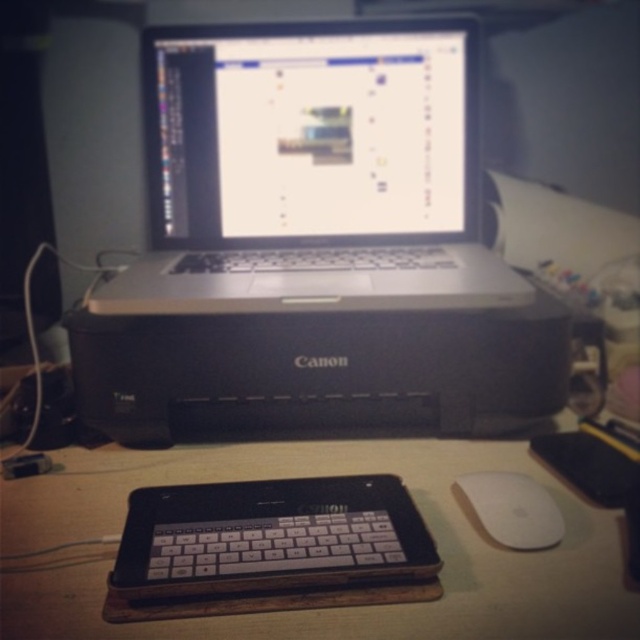
Question: Considering the real-world distances, which object is farthest from the white matte mouse at lower right?

Choices:
 (A) matte silver laptop at center
 (B) wooden table at center
 (C) silver/black plastic printer at center

Answer: (A)

Question: Which point is farther from the camera taking this photo?

Choices:
 (A) (484, 524)
 (B) (148, 147)
 (C) (436, 624)
 (D) (369, 93)

Answer: (B)

Question: Does matte silver laptop at center appear on the left side of wooden table at center?

Choices:
 (A) no
 (B) yes

Answer: (A)

Question: Among these objects, which one is nearest to the camera?

Choices:
 (A) white matte mouse at lower right
 (B) silver/black plastic printer at center
 (C) matte silver laptop at center
 (D) wooden table at center

Answer: (D)

Question: Observing the image, what is the correct spatial positioning of silver/black plastic printer at center in reference to matte silver laptop at center?

Choices:
 (A) below
 (B) above

Answer: (A)

Question: Can you confirm if silver/black plastic printer at center is positioned to the left of wooden table at center?

Choices:
 (A) yes
 (B) no

Answer: (B)